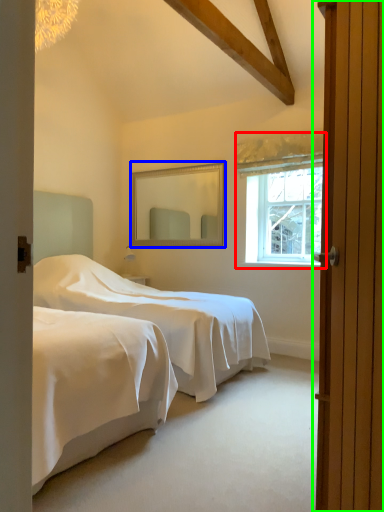
Question: Considering the real-world distances, which object is farthest from window (highlighted by a red box)? mirror (highlighted by a blue box) or door (highlighted by a green box)?

Choices:
 (A) mirror
 (B) door

Answer: (B)